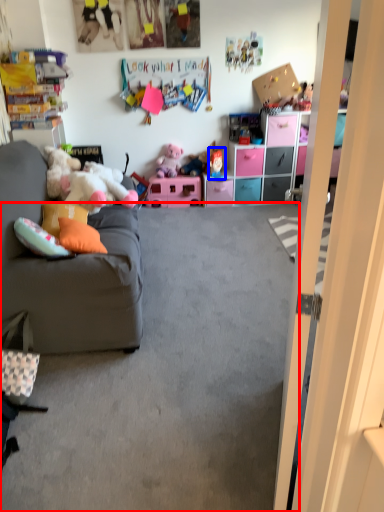
Question: Which object appears closest to the camera in this image, plain (highlighted by a red box) or toy (highlighted by a blue box)?

Choices:
 (A) plain
 (B) toy

Answer: (A)